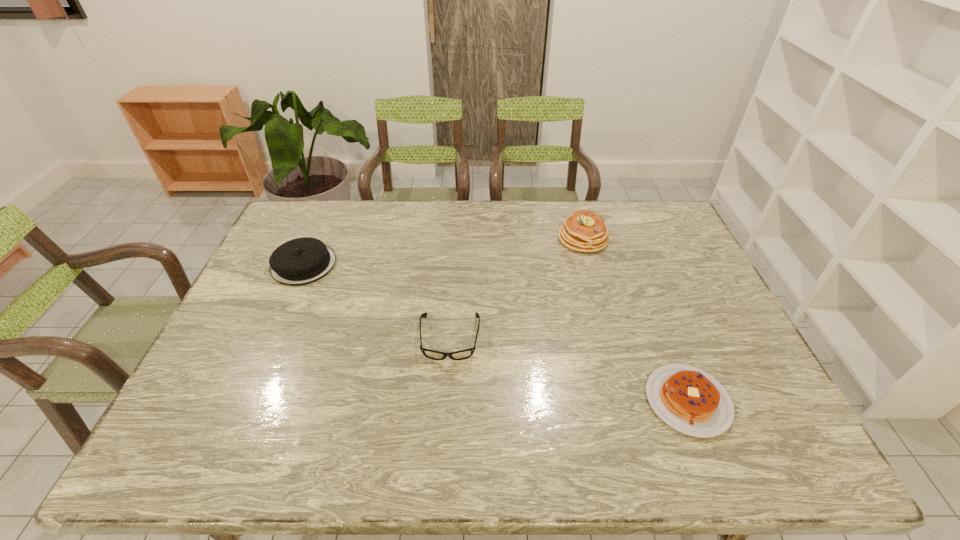
Choose which object is the nearest neighbor to the tallest pancake. Please provide its 2D coordinates. Your answer should be formatted as a tuple, i.e. [(x, y)], where the tuple contains the x and y coordinates of a point satisfying the conditions above.

[(467, 353)]

Choose which object is the third nearest neighbor to the nearest object. Please provide its 2D coordinates. Your answer should be formatted as a tuple, i.e. [(x, y)], where the tuple contains the x and y coordinates of a point satisfying the conditions above.

[(300, 261)]

This screenshot has width=960, height=540. In order to click on pancake that is the second closest to the tallest object in this screenshot , I will do `click(300, 261)`.

Select which pancake appears as the closest to the shortest pancake. Please provide its 2D coordinates. Your answer should be formatted as a tuple, i.e. [(x, y)], where the tuple contains the x and y coordinates of a point satisfying the conditions above.

[(585, 231)]

This screenshot has height=540, width=960. Identify the location of free point that satisfies the following two spatial constraints: 1. on the front-facing side of the second nearest object; 2. on the left side of the shortest pancake. (446, 401).